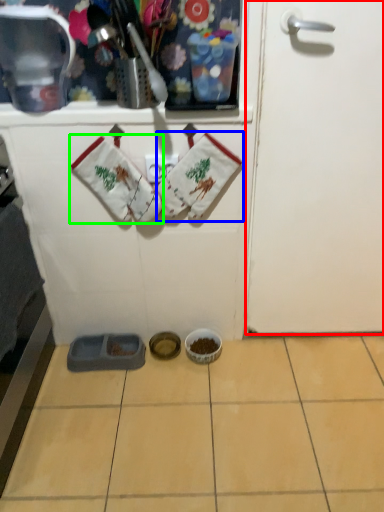
Question: Considering the real-world distances, which object is farthest from door (highlighted by a red box)? baby clothe (highlighted by a blue box) or baby clothe (highlighted by a green box)?

Choices:
 (A) baby clothe
 (B) baby clothe

Answer: (B)